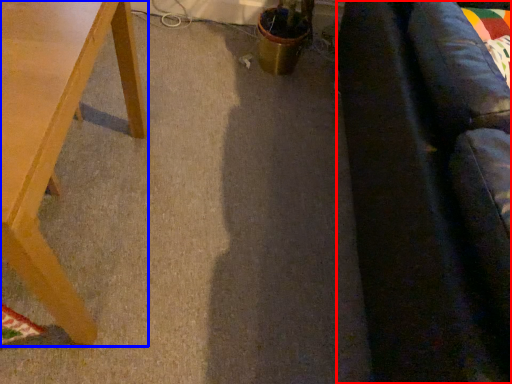
Question: Among these objects, which one is farthest to the camera, couch (highlighted by a red box) or table (highlighted by a blue box)?

Choices:
 (A) couch
 (B) table

Answer: (B)